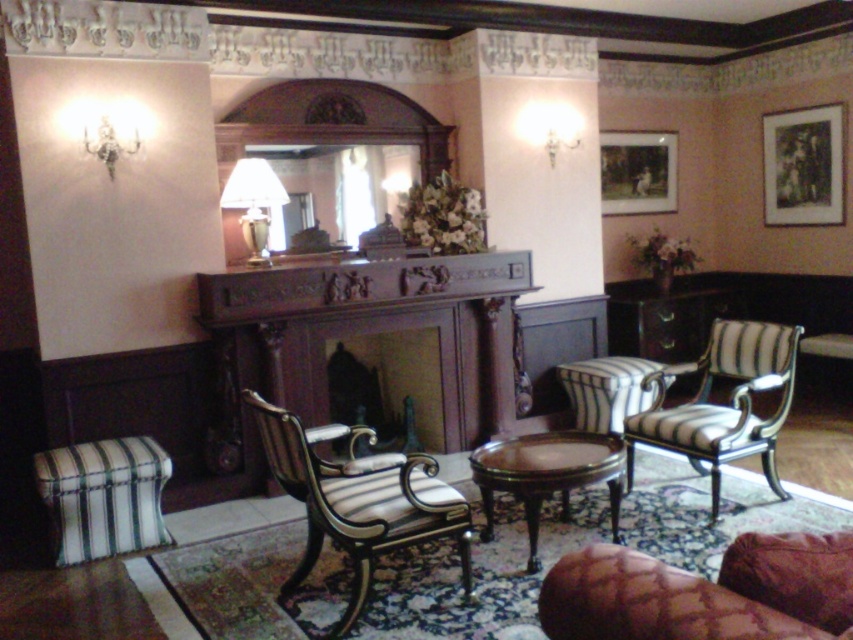
Based on the photo, which is above, black matte picture frame at upper right or matte white glass lamp at left?

black matte picture frame at upper right

Where is `black matte picture frame at upper right`? The image size is (853, 640). black matte picture frame at upper right is located at coordinates (804, 166).

Is point (772, 176) farther from viewer compared to point (247, 180)?

Yes.

Identify the location of black matte picture frame at upper right. (804, 166).

Is point (677, 404) positioned after point (593, 403)?

Yes, point (677, 404) is farther from viewer.

You are a GUI agent. You are given a task and a screenshot of the screen. Output one action in this format:
    pyautogui.click(x=<x>, y=<y>)
    Task: Click on the striped fabric armchair at right
    
    Given the screenshot: What is the action you would take?
    pyautogui.click(x=722, y=404)

Can you confirm if striped fabric armchair at right is shorter than mahogany wood coffee table at center?

Incorrect, striped fabric armchair at right's height does not fall short of mahogany wood coffee table at center's.

Which is below, striped fabric armchair at right or mahogany wood coffee table at center?

mahogany wood coffee table at center

Is point (749, 428) in front of point (540, 449)?

No, (749, 428) is further to viewer.

Locate an element on the screen. The image size is (853, 640). striped fabric armchair at right is located at coordinates (722, 404).